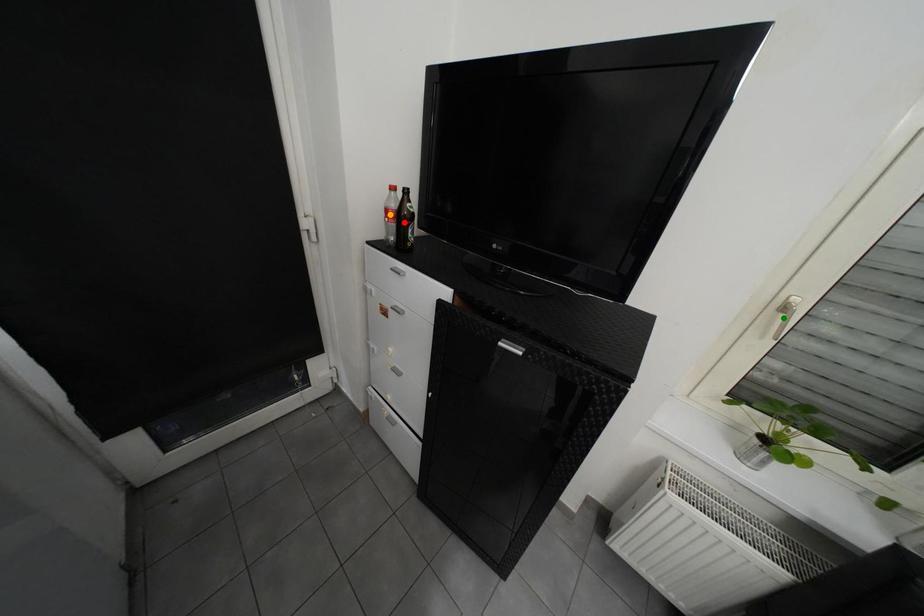
Order these from nearest to farthest:
A) red point
B) orange point
C) green point

1. green point
2. red point
3. orange point